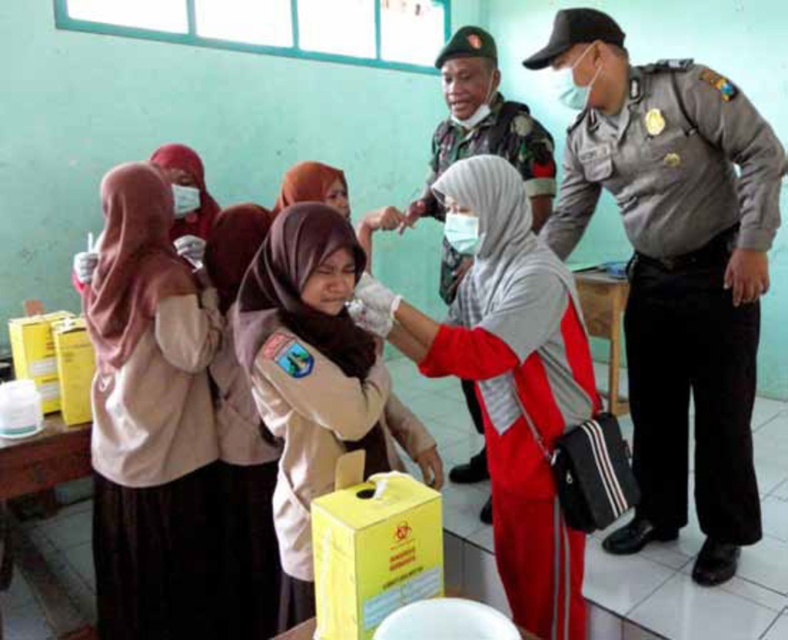
Question: Among these objects, which one is farthest from the camera?

Choices:
 (A) matte white uniform at center
 (B) red fabric hijab at center
 (C) gray uniformed officer at right
 (D) pale beige hijab at upper left

Answer: (C)

Question: Considering the relative positions of red fabric hijab at center and matte khaki uniform at center in the image provided, where is red fabric hijab at center located with respect to matte khaki uniform at center?

Choices:
 (A) right
 (B) left

Answer: (B)

Question: Observing the image, what is the correct spatial positioning of gray uniformed officer at right in reference to matte white uniform at center?

Choices:
 (A) above
 (B) below

Answer: (A)

Question: Can you confirm if red fabric hijab at center is positioned above matte white uniform at center?

Choices:
 (A) no
 (B) yes

Answer: (A)

Question: Which point is farther to the camera?

Choices:
 (A) matte khaki uniform at center
 (B) red fabric hijab at center
 (C) gray uniformed officer at right

Answer: (A)

Question: Which object is the farthest from the matte khaki uniform at center?

Choices:
 (A) pale beige hijab at upper left
 (B) red fabric hijab at center
 (C) gray uniformed officer at right
 (D) matte white uniform at center

Answer: (A)